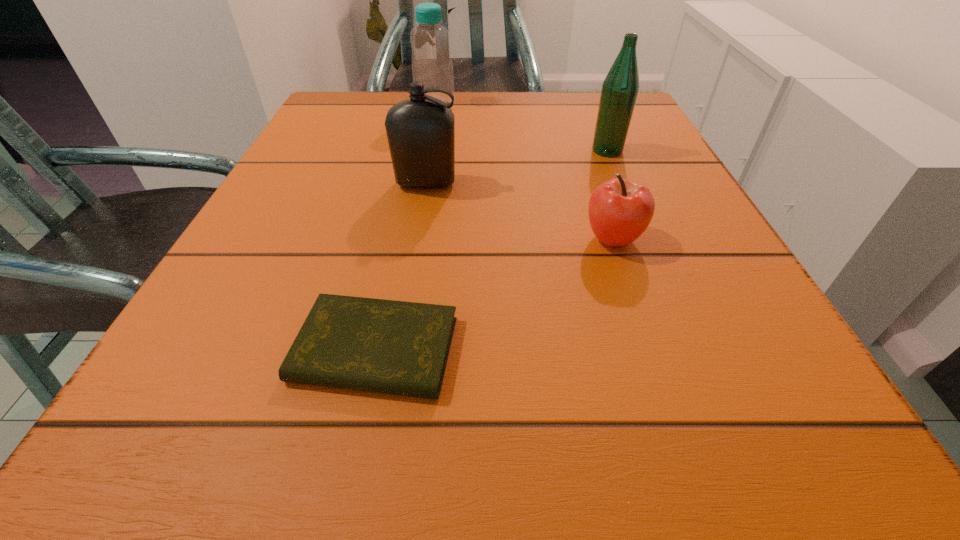
This screenshot has height=540, width=960. Identify the location of vacant space at the far edge of the desktop. (483, 122).

The height and width of the screenshot is (540, 960). Find the location of `vacant region at the near edge`. vacant region at the near edge is located at coordinates (329, 416).

Where is `vacant space at the left edge of the desktop`? vacant space at the left edge of the desktop is located at coordinates (236, 249).

What are the coordinates of `free spot at the right edge of the desktop` in the screenshot? It's located at (643, 330).

This screenshot has width=960, height=540. In the image, there is a desktop. What are the coordinates of `blank space at the far left corner` in the screenshot? It's located at (356, 121).

Locate an element on the screen. The width and height of the screenshot is (960, 540). vacant space at the near left corner is located at coordinates [262, 411].

This screenshot has width=960, height=540. In the image, there is a desktop. Find the location of `vacant space at the near right corner`. vacant space at the near right corner is located at coordinates (787, 438).

The image size is (960, 540). Find the location of `vacant area that lies between the farthest object and the diary`. vacant area that lies between the farthest object and the diary is located at coordinates (405, 227).

At what (x,y) coordinates should I click in order to perform the action: click on free space between the diary and the nearest bottle. Please return your answer as a coordinate pair (x, y). Looking at the image, I should click on 400,267.

The width and height of the screenshot is (960, 540). Find the location of `free area in between the farthest object and the nearest object`. free area in between the farthest object and the nearest object is located at coordinates (405, 227).